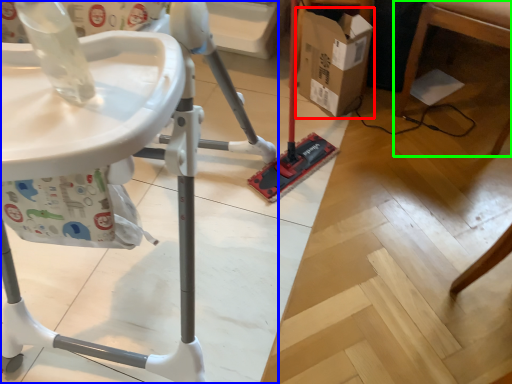
Question: Which object is the closest to the cardboard box (highlighted by a red box)? Choose among these: furniture (highlighted by a blue box) or furniture (highlighted by a green box).

Choices:
 (A) furniture
 (B) furniture

Answer: (B)